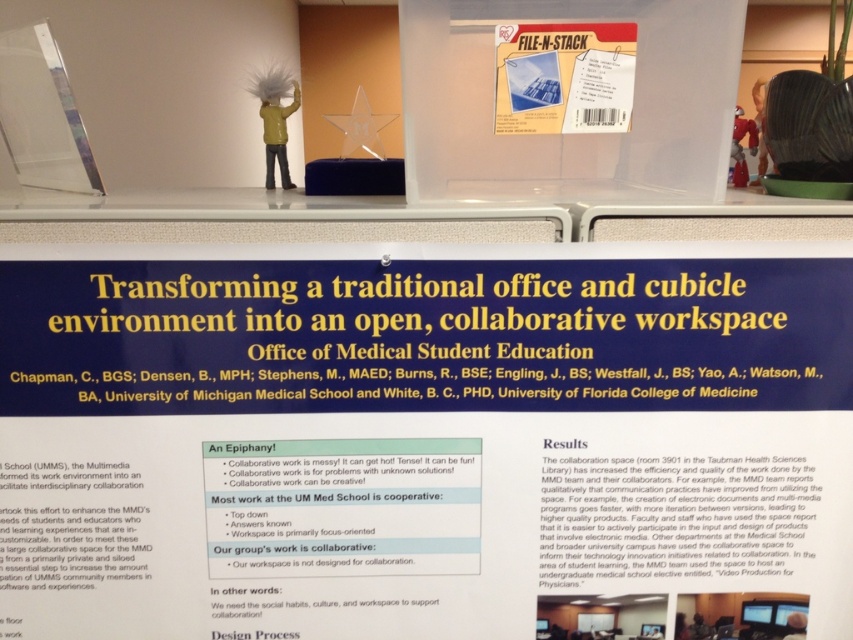
You are an observer looking at the poster. You want to know which object is closer to you between the transparent plastic container at center and the matte plastic file folder at upper center. Can you determine this?

The transparent plastic container at center is closer to the viewer than the matte plastic file folder at upper center.